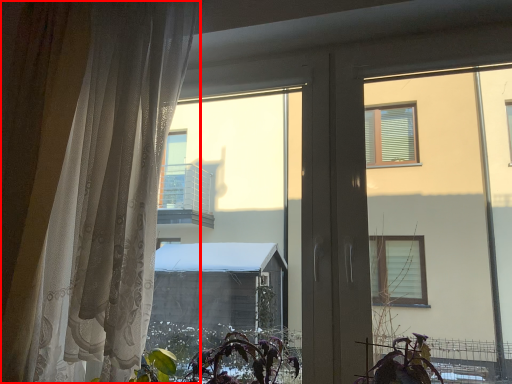
Question: Observing the image, what is the correct spatial positioning of curtain (annotated by the red box) in reference to vegetation?

Choices:
 (A) right
 (B) left

Answer: (B)